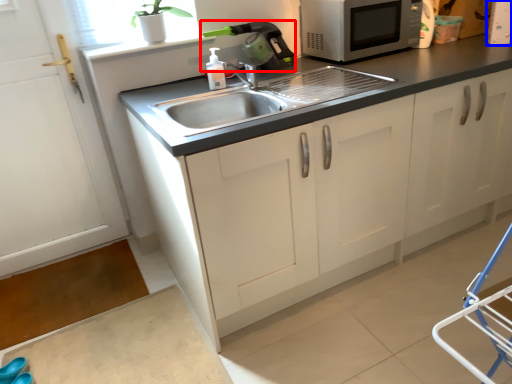
Question: Which of the following is the closest to the observer, appliance (highlighted by a red box) or appliance (highlighted by a blue box)?

Choices:
 (A) appliance
 (B) appliance

Answer: (A)